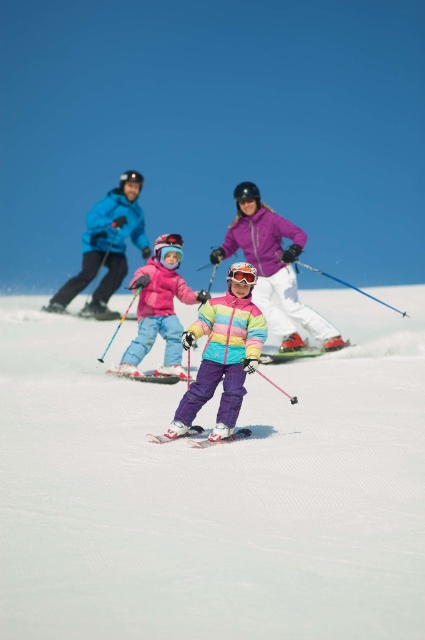
You are a skier who wants to place a 1.5 meter long ski pole between the white smooth snow at center and the white matte ski at center. Is there enough space to place the pole without it overlapping either object?

The distance between the white smooth snow at center and the white matte ski at center is 1.49 meters. Since the ski pole is 1.5 meters long, it would overlap both objects when placed between them.